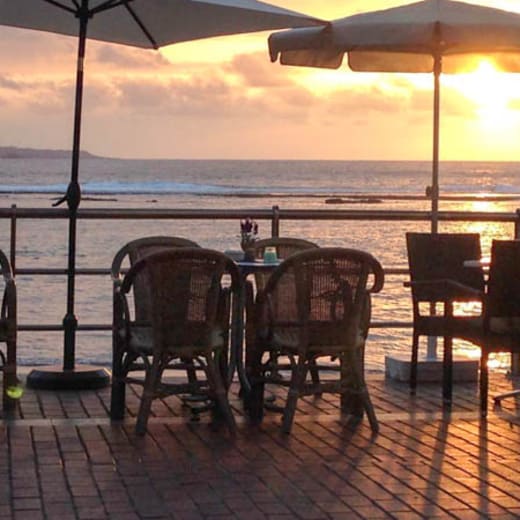
Where is `brown brick flooring`? brown brick flooring is located at coordinates (364, 490).